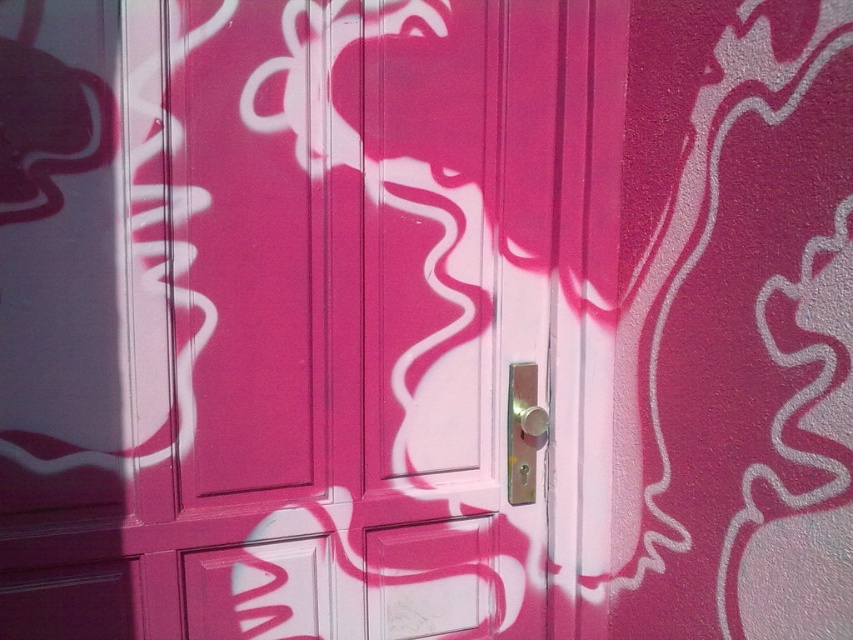
Is matte pink door at center further to the viewer compared to metallic gold door handle at center?

No, it is in front of metallic gold door handle at center.

The image size is (853, 640). What do you see at coordinates (334, 332) in the screenshot? I see `matte pink door at center` at bounding box center [334, 332].

What are the coordinates of `matte pink door at center` in the screenshot? It's located at (334, 332).

The height and width of the screenshot is (640, 853). In order to click on matte pink door at center in this screenshot , I will do `click(334, 332)`.